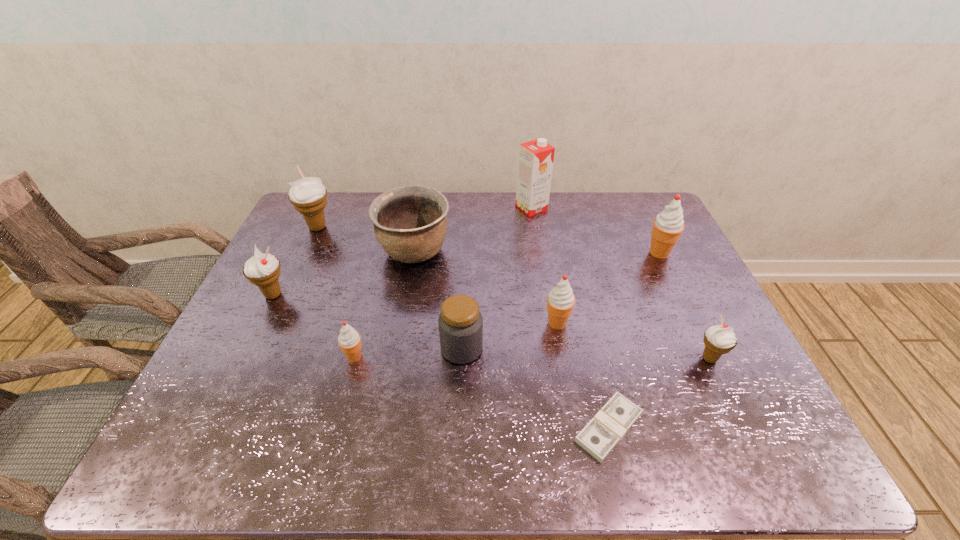
Identify the location of pottery that is at the far edge. (410, 223).

I want to click on object located in the near edge section of the desktop, so click(611, 423).

Where is `object that is at the far left corner`? This screenshot has height=540, width=960. object that is at the far left corner is located at coordinates (308, 195).

You are a GUI agent. You are given a task and a screenshot of the screen. Output one action in this format:
    pyautogui.click(x=<x>, y=<y>)
    Task: Click on the vacant space at the far edge of the desktop
    The height and width of the screenshot is (540, 960).
    Given the screenshot: What is the action you would take?
    pyautogui.click(x=609, y=224)

This screenshot has width=960, height=540. What are the coordinates of `vacant area at the near edge` in the screenshot? It's located at (348, 442).

Image resolution: width=960 pixels, height=540 pixels. I want to click on vacant space at the left edge of the desktop, so click(234, 356).

Locate an element on the screen. vacant area between the carton and the nearest white icecream is located at coordinates (620, 283).

At what (x,y) coordinates should I click in order to perform the action: click on free space between the smallest white icecream and the gray jar. Please return your answer as a coordinate pair (x, y). This screenshot has height=540, width=960. Looking at the image, I should click on (586, 354).

Image resolution: width=960 pixels, height=540 pixels. What are the coordinates of `vacant area between the nearest object and the pottery` in the screenshot? It's located at (512, 340).

Locate an element on the screen. vacant space that's between the biggest white icecream and the pottery is located at coordinates (366, 240).